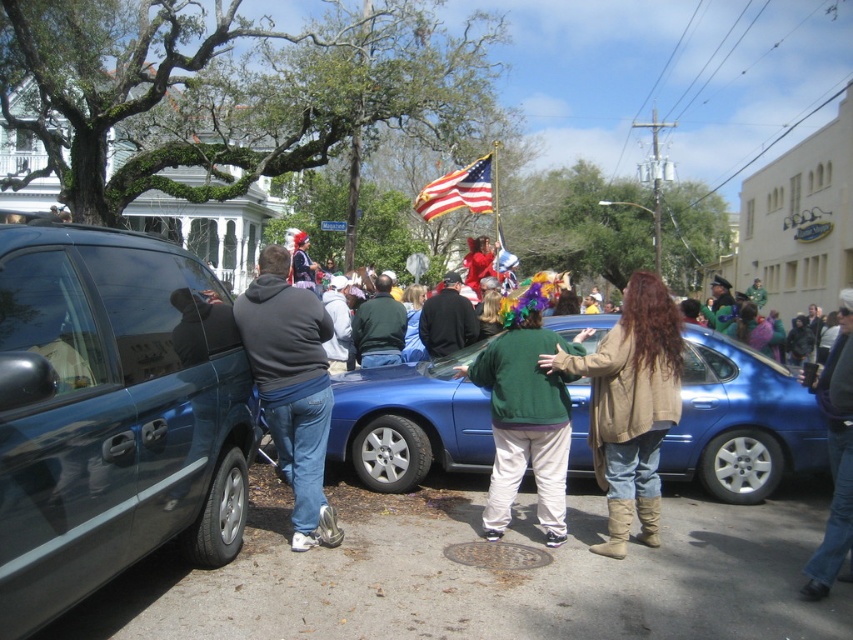
Is green sweater at center wider than american flag at center?

In fact, green sweater at center might be narrower than american flag at center.

Who is shorter, green sweater at center or american flag at center?

green sweater at center is shorter.

You are a GUI agent. You are given a task and a screenshot of the screen. Output one action in this format:
    pyautogui.click(x=<x>, y=<y>)
    Task: Click on the green sweater at center
    This screenshot has height=640, width=853.
    Given the screenshot: What is the action you would take?
    pyautogui.click(x=630, y=404)

Who is shorter, blue metallic car at center or green fleece jacket at center?

Standing shorter between the two is blue metallic car at center.

Does point (711, 492) lie in front of point (500, 451)?

That is False.

Is point (703, 378) farther from camera compared to point (519, 461)?

Yes, it is.

The image size is (853, 640). I want to click on blue metallic car at center, so click(740, 420).

Can you confirm if green sweater at center is positioned to the left of green matte jacket at center?

In fact, green sweater at center is to the right of green matte jacket at center.

Describe the element at coordinates (630, 404) in the screenshot. The height and width of the screenshot is (640, 853). I see `green sweater at center` at that location.

Is point (628, 417) positioned in front of point (378, 312)?

Yes, it is.

Where is `green sweater at center`? Image resolution: width=853 pixels, height=640 pixels. green sweater at center is located at coordinates (630, 404).